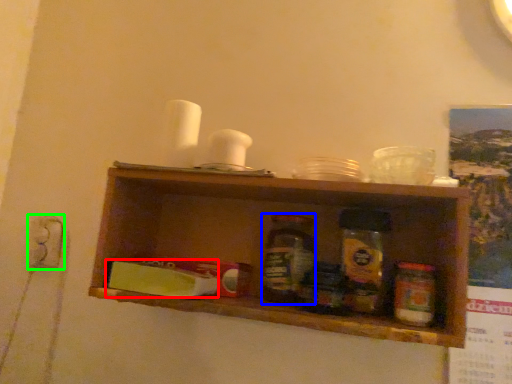
Question: Which object is the closest to the food (highlighted by a red box)? Choose among these: bottle (highlighted by a blue box) or electric outlet (highlighted by a green box).

Choices:
 (A) bottle
 (B) electric outlet

Answer: (A)